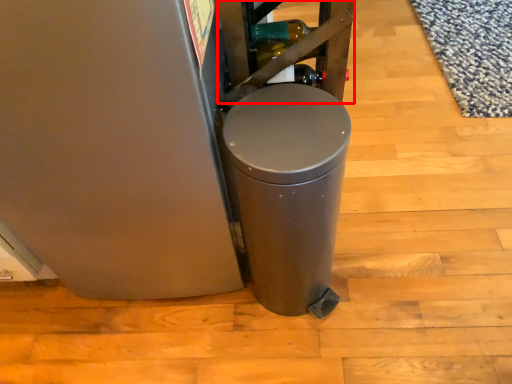
Question: From the image's perspective, what is the correct spatial relationship of shelf (annotated by the red box) in relation to waste container?

Choices:
 (A) above
 (B) below

Answer: (A)